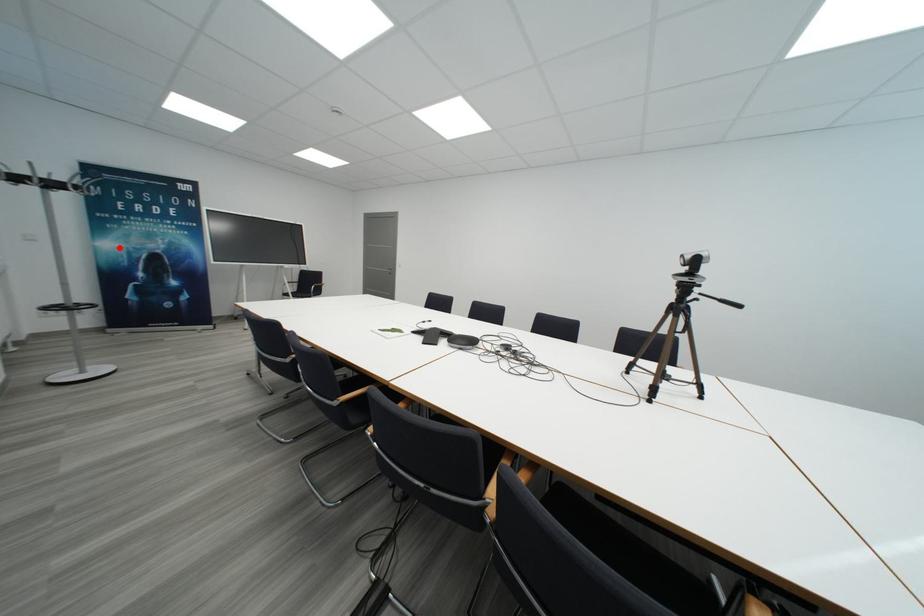
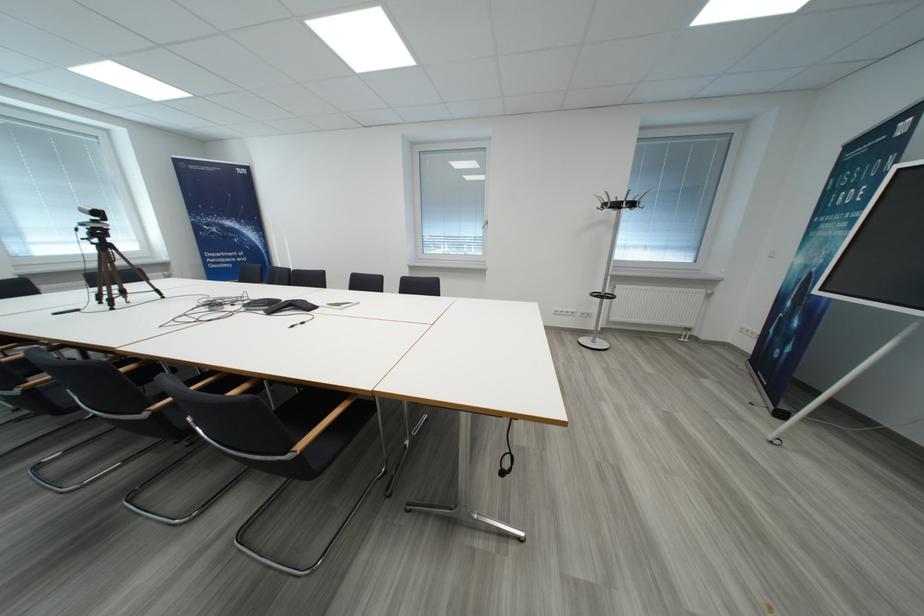
The point at the highlighted location is marked in the first image. Where is the corresponding point in the second image?

(807, 264)